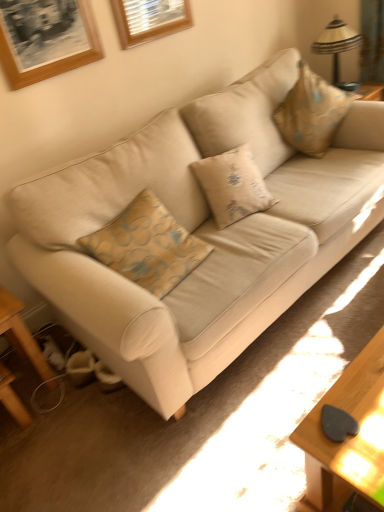
Question: Considering the relative sizes of wooden picture frame at upper center, the second picture frame from the front, and beige fabric pillow at upper right in the image provided, is wooden picture frame at upper center, the second picture frame from the front, smaller than beige fabric pillow at upper right?

Choices:
 (A) yes
 (B) no

Answer: (A)

Question: Considering the relative sizes of wooden picture frame at upper center, which is counted as the 1th picture frame, starting from the right, and beige fabric pillow at upper right in the image provided, is wooden picture frame at upper center, which is counted as the 1th picture frame, starting from the right, bigger than beige fabric pillow at upper right?

Choices:
 (A) yes
 (B) no

Answer: (B)

Question: Considering the relative sizes of wooden picture frame at upper center, the second picture frame from the front, and beige fabric pillow at upper right in the image provided, is wooden picture frame at upper center, the second picture frame from the front, shorter than beige fabric pillow at upper right?

Choices:
 (A) yes
 (B) no

Answer: (A)

Question: From a real-world perspective, is wooden picture frame at upper center, which is counted as the 1th picture frame, starting from the right, positioned under beige fabric pillow at upper right based on gravity?

Choices:
 (A) no
 (B) yes

Answer: (A)

Question: Is wooden picture frame at upper center, which is the first picture frame from back to front, next to beige fabric pillow at upper right and touching it?

Choices:
 (A) no
 (B) yes

Answer: (A)

Question: Is wooden picture frame at upper center, which is the first picture frame from back to front, facing away from beige fabric pillow at upper right?

Choices:
 (A) no
 (B) yes

Answer: (A)

Question: Does beige fabric pillow at upper right turn towards wooden table at lower left?

Choices:
 (A) yes
 (B) no

Answer: (B)

Question: Is the depth of beige fabric pillow at upper right less than that of wooden table at lower left?

Choices:
 (A) no
 (B) yes

Answer: (A)

Question: Can you confirm if beige fabric pillow at upper right is wider than wooden table at lower left?

Choices:
 (A) no
 (B) yes

Answer: (B)

Question: Considering the relative sizes of beige fabric pillow at upper right and wooden table at lower left in the image provided, is beige fabric pillow at upper right shorter than wooden table at lower left?

Choices:
 (A) no
 (B) yes

Answer: (A)

Question: From a real-world perspective, is beige fabric pillow at upper right positioned under wooden table at lower left based on gravity?

Choices:
 (A) yes
 (B) no

Answer: (B)

Question: Considering the relative sizes of beige fabric pillow at upper right and wooden table at lower left in the image provided, is beige fabric pillow at upper right bigger than wooden table at lower left?

Choices:
 (A) yes
 (B) no

Answer: (A)

Question: From a real-world perspective, is beige fabric couch at center on wooden picture frame at upper left, which ranks as the first picture frame in front-to-back order?

Choices:
 (A) no
 (B) yes

Answer: (A)